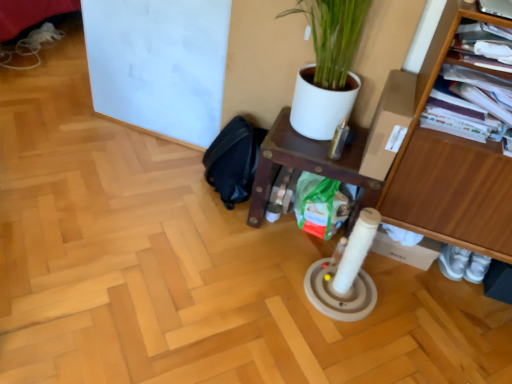
This screenshot has height=384, width=512. Identify the location of free space between wooden shelf at center and black fabric swivel chair at lower center. (220, 215).